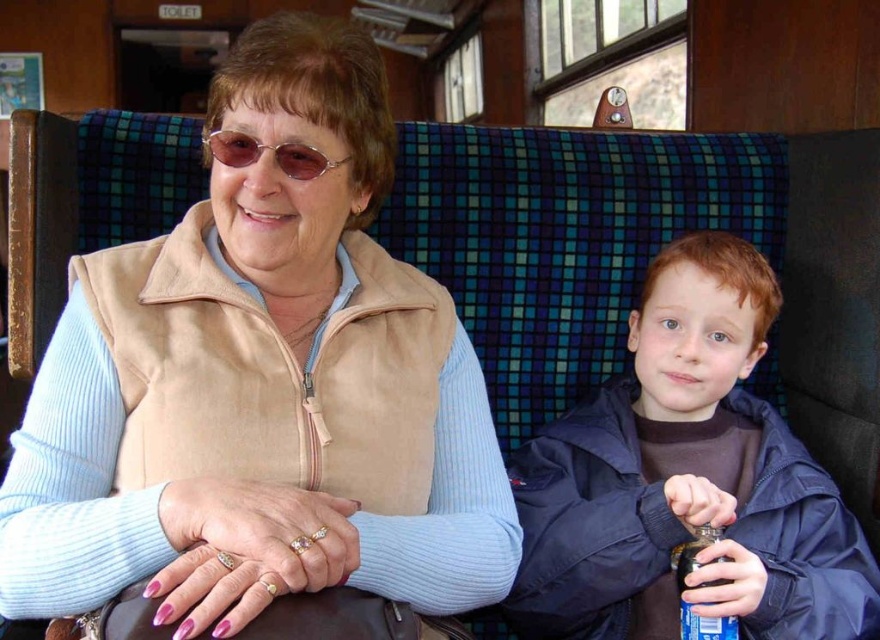
Does matte beige vest at center have a larger size compared to dark blue jacket at right?

Yes.

Looking at this image, is matte beige vest at center smaller than dark blue jacket at right?

No.

Identify the location of matte beige vest at center. The image size is (880, 640). (261, 385).

Between point (279, 150) and point (700, 536), which one is positioned behind?

The point (700, 536) is behind.

The width and height of the screenshot is (880, 640). Identify the location of sunglasses at center. (272, 154).

You are a GUI agent. You are given a task and a screenshot of the screen. Output one action in this format:
    pyautogui.click(x=<x>, y=<y>)
    Task: Click on the sunglasses at center
    This screenshot has width=880, height=640.
    Given the screenshot: What is the action you would take?
    pyautogui.click(x=272, y=154)

Where is `sunglasses at center`? sunglasses at center is located at coordinates (272, 154).

Is point (442, 513) positioned before point (698, 545)?

Yes, it is.

The width and height of the screenshot is (880, 640). What do you see at coordinates (261, 385) in the screenshot?
I see `matte beige vest at center` at bounding box center [261, 385].

Identify the location of matte beige vest at center. This screenshot has width=880, height=640. (261, 385).